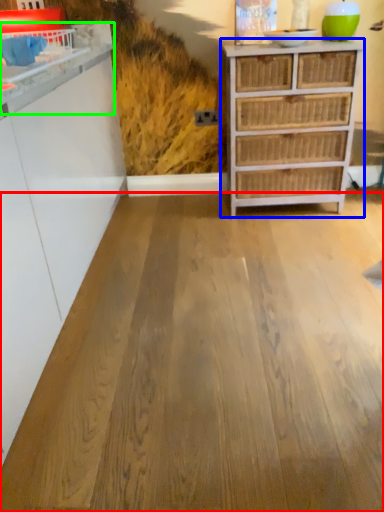
Question: Estimate the real-world distances between objects in this image. Which object is closer to plywood (highlighted by a red box), chest of drawers (highlighted by a blue box) or counter (highlighted by a green box)?

Choices:
 (A) chest of drawers
 (B) counter

Answer: (A)